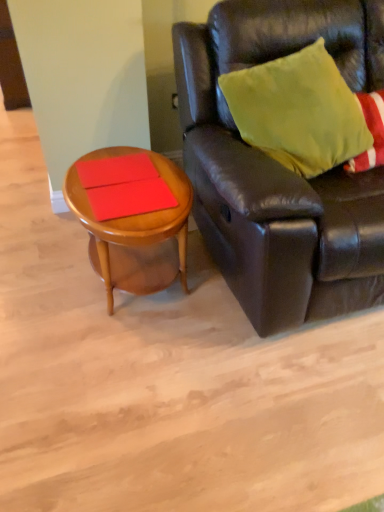
Question: Looking at the image, does woodenobject at left seem bigger or smaller compared to matte red book at left, positioned as the second plank in bottom-to-top order?

Choices:
 (A) big
 (B) small

Answer: (A)

Question: From the image's perspective, relative to matte red book at left, the first plank viewed from the top, is woodenobject at left above or below?

Choices:
 (A) below
 (B) above

Answer: (A)

Question: Estimate the real-world distances between objects in this image. Which object is farther from the matte red book at center, positioned as the second plank in top-to-bottom order?

Choices:
 (A) leather couch at right
 (B) matte red book at left, positioned as the second plank in bottom-to-top order
 (C) woodenobject at left

Answer: (A)

Question: Estimate the real-world distances between objects in this image. Which object is closer to the leather couch at right?

Choices:
 (A) woodenobject at left
 (B) matte red book at left, positioned as the second plank in bottom-to-top order
 (C) matte red book at center, positioned as the second plank in top-to-bottom order

Answer: (A)